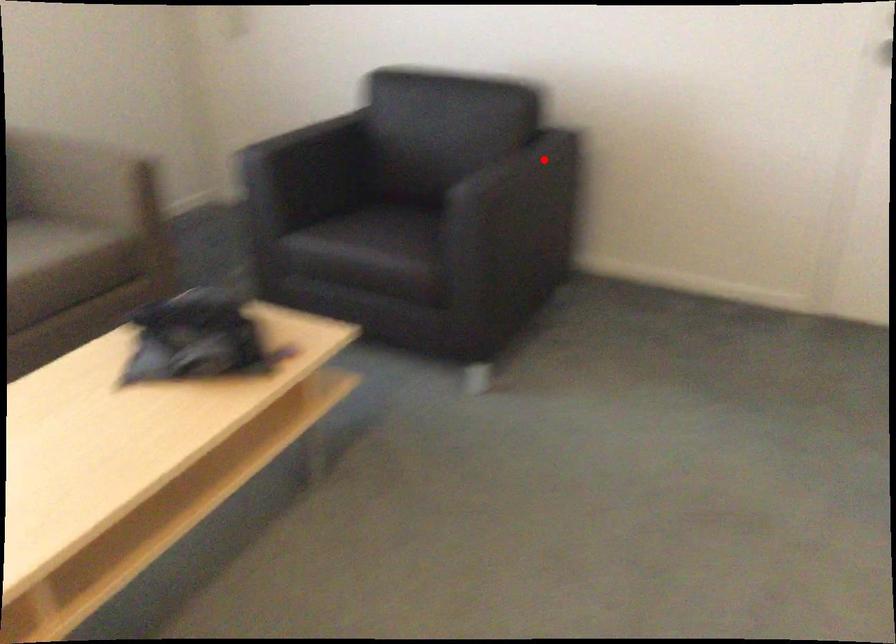
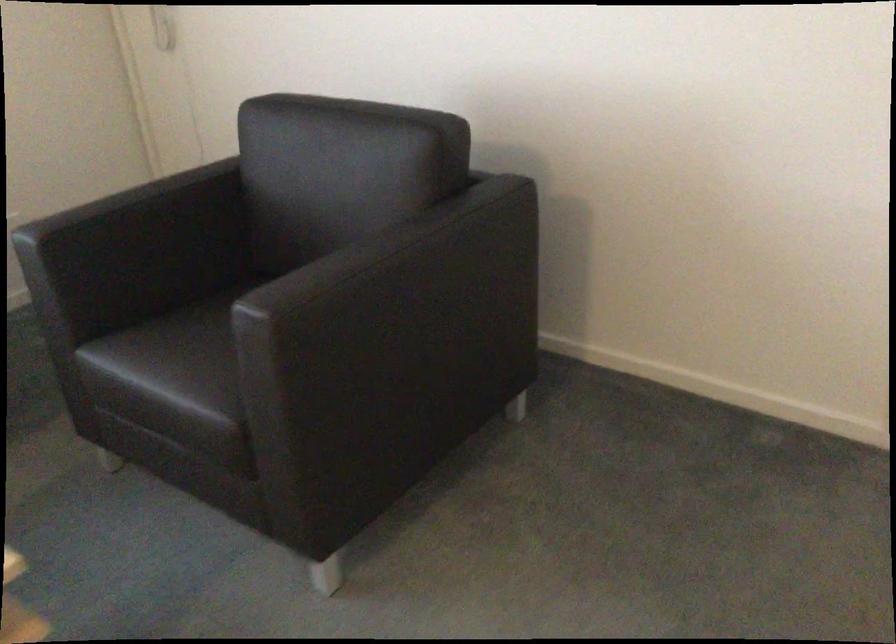
Question: I am providing you with two images of the same scene from different viewpoints. In image1, a red point is highlighted. Considering the same 3D point in image2, which of the following is correct?

Choices:
 (A) It is closer
 (B) It is farther

Answer: (A)